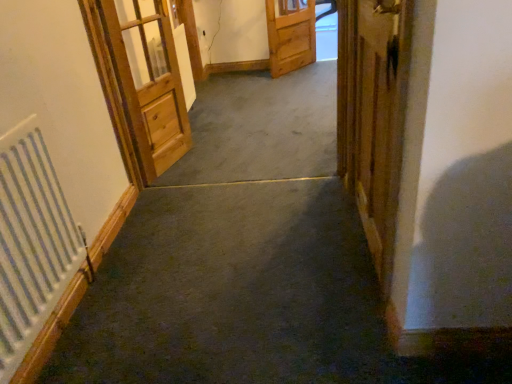
Question: Is light brown wooden door at left, arranged as the second door when viewed from the front, positioned behind white metallic radiator at left?

Choices:
 (A) no
 (B) yes

Answer: (B)

Question: Does light brown wooden door at left, which ranks as the 3th door in right-to-left order, turn towards white metallic radiator at left?

Choices:
 (A) yes
 (B) no

Answer: (B)

Question: From the image's perspective, is light brown wooden door at left, marked as the second door in a back-to-front arrangement, on top of white metallic radiator at left?

Choices:
 (A) no
 (B) yes

Answer: (B)

Question: Is light brown wooden door at left, marked as the second door in a back-to-front arrangement, positioned far away from white metallic radiator at left?

Choices:
 (A) yes
 (B) no

Answer: (A)

Question: Can you confirm if light brown wooden door at left, marked as the second door in a back-to-front arrangement, is wider than white metallic radiator at left?

Choices:
 (A) yes
 (B) no

Answer: (A)

Question: From a real-world perspective, is wooden drawer at center positioned above or below light brown wooden door at left, arranged as the second door when viewed from the front?

Choices:
 (A) below
 (B) above

Answer: (A)

Question: Would you say wooden drawer at center is inside or outside light brown wooden door at left, marked as the second door in a back-to-front arrangement?

Choices:
 (A) inside
 (B) outside

Answer: (B)

Question: Does point (291, 26) appear closer or farther from the camera than point (130, 107)?

Choices:
 (A) farther
 (B) closer

Answer: (A)

Question: In terms of size, does wooden drawer at center appear bigger or smaller than light brown wooden door at left, arranged as the second door when viewed from the front?

Choices:
 (A) small
 (B) big

Answer: (A)

Question: Choose the correct answer: Is light brown wooden door at left, marked as the second door in a back-to-front arrangement, inside white metallic radiator at left or outside it?

Choices:
 (A) inside
 (B) outside

Answer: (B)

Question: From a real-world perspective, is light brown wooden door at left, which ranks as the 3th door in right-to-left order, physically located above or below white metallic radiator at left?

Choices:
 (A) above
 (B) below

Answer: (A)

Question: Based on their positions, is light brown wooden door at left, which ranks as the 3th door in right-to-left order, located to the left or right of white metallic radiator at left?

Choices:
 (A) right
 (B) left

Answer: (A)

Question: Is light brown wooden door at left, which ranks as the 3th door in right-to-left order, wider or thinner than white metallic radiator at left?

Choices:
 (A) thin
 (B) wide

Answer: (B)

Question: From the image's perspective, is light brown wooden door at left, which ranks as the 3th door in right-to-left order, located above or below wooden door at right, the third door in the left-to-right sequence?

Choices:
 (A) above
 (B) below

Answer: (A)

Question: From a real-world perspective, is light brown wooden door at left, arranged as the second door when viewed from the front, positioned above or below wooden door at right, placed as the first door when sorted from front to back?

Choices:
 (A) above
 (B) below

Answer: (A)